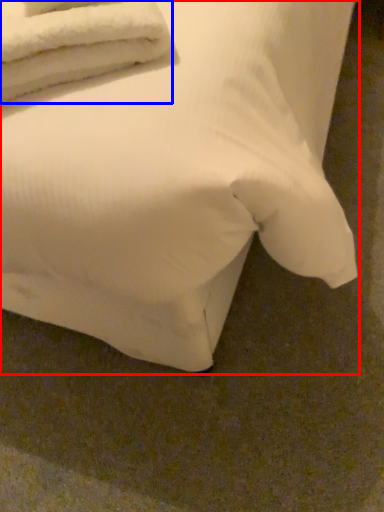
Question: Among these objects, which one is nearest to the camera, bed (highlighted by a red box) or towel (highlighted by a blue box)?

Choices:
 (A) bed
 (B) towel

Answer: (A)